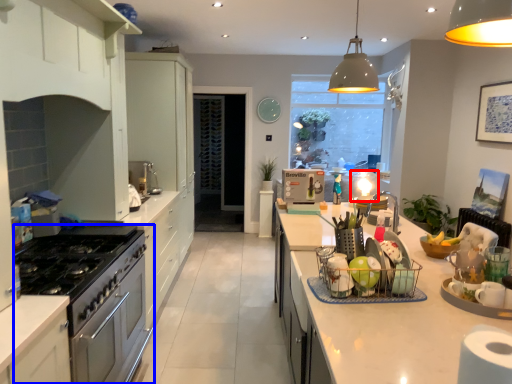
Question: Which point is further to the camera, appliance (highlighted by a red box) or kitchen appliance (highlighted by a blue box)?

Choices:
 (A) appliance
 (B) kitchen appliance

Answer: (A)